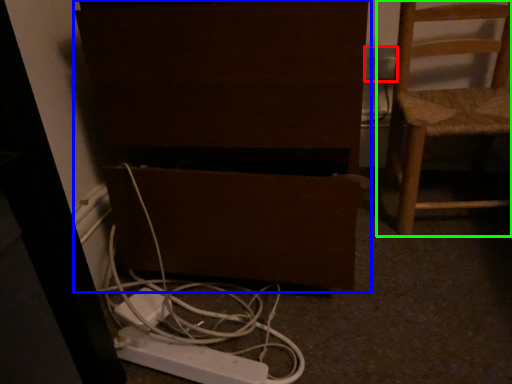
Question: Estimate the real-world distances between objects in this image. Which object is farther from electric outlet (highlighted by a red box), furniture (highlighted by a blue box) or chair (highlighted by a green box)?

Choices:
 (A) furniture
 (B) chair

Answer: (A)